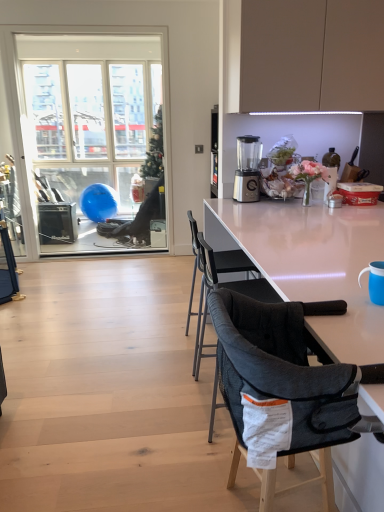
The height and width of the screenshot is (512, 384). In order to click on white glossy table at center in this screenshot , I will do `click(312, 263)`.

At what (x,y) coordinates should I click in order to perform the action: click on blue plastic cup at right. Please return your answer as a coordinate pair (x, y). Looking at the image, I should click on (375, 281).

Identify the location of sleek silver blender at center. (247, 169).

What do you see at coordinates (283, 367) in the screenshot?
I see `dark gray mesh chair at center, the 1th chair viewed from the front` at bounding box center [283, 367].

Locate an element on the screen. This screenshot has width=384, height=512. white glossy table at center is located at coordinates (312, 263).

Is dark gray fabric chair at center, placed as the second chair when sorted from front to back, thinner than clear glass window at left?

No, dark gray fabric chair at center, placed as the second chair when sorted from front to back, is not thinner than clear glass window at left.

Is dark gray fabric chair at center, the first chair from the back, not close to clear glass window at left?

Yes, dark gray fabric chair at center, the first chair from the back, is far from clear glass window at left.

Considering the positions of objects dark gray fabric chair at center, the first chair from the back, and clear glass window at left in the image provided, who is behind, dark gray fabric chair at center, the first chair from the back, or clear glass window at left?

clear glass window at left is more distant.

Considering the sizes of dark gray fabric chair at center, the first chair from the back, and clear glass window at left in the image, is dark gray fabric chair at center, the first chair from the back, bigger or smaller than clear glass window at left?

Considering their sizes, dark gray fabric chair at center, the first chair from the back, takes up more space than clear glass window at left.

From a real-world perspective, which is physically below, dark gray mesh chair at center, the 1th chair viewed from the front, or blue plastic cup at right?

In real-world perspective, dark gray mesh chair at center, the 1th chair viewed from the front, is lower.

Considering the sizes of dark gray mesh chair at center, the 1th chair viewed from the front, and blue plastic cup at right in the image, is dark gray mesh chair at center, the 1th chair viewed from the front, wider or thinner than blue plastic cup at right?

Clearly, dark gray mesh chair at center, the 1th chair viewed from the front, has more width compared to blue plastic cup at right.

Would you consider dark gray mesh chair at center, the second chair viewed from the back, to be distant from blue plastic cup at right?

That's not correct — dark gray mesh chair at center, the second chair viewed from the back, is a little close to blue plastic cup at right.

Looking at this image, could you tell me if dark gray mesh chair at center, the second chair viewed from the back, is facing blue plastic cup at right?

Yes.

Locate an element on the screen. the 2nd chair below the sleek silver blender at center (from the image's perspective) is located at coordinates (283, 367).

From a real-world perspective, which is physically above, sleek silver blender at center or dark gray mesh chair at center, the 1th chair viewed from the front?

sleek silver blender at center.

Are sleek silver blender at center and dark gray mesh chair at center, the 1th chair viewed from the front, located far from each other?

sleek silver blender at center is far away from dark gray mesh chair at center, the 1th chair viewed from the front.

How many degrees apart are the facing directions of sleek silver blender at center and dark gray mesh chair at center, the second chair viewed from the back?

There is a 78-degree angle between the facing directions of sleek silver blender at center and dark gray mesh chair at center, the second chair viewed from the back.

Could dark gray fabric chair at center, placed as the second chair when sorted from front to back, be considered to be inside clear glass window at left?

That's incorrect, dark gray fabric chair at center, placed as the second chair when sorted from front to back, is not inside clear glass window at left.

Considering the relative positions of clear glass window at left and dark gray fabric chair at center, the first chair from the back, in the image provided, is clear glass window at left behind dark gray fabric chair at center, the first chair from the back,?

Yes, clear glass window at left is further from the camera.

Considering the sizes of clear glass window at left and dark gray fabric chair at center, the first chair from the back, in the image, is clear glass window at left wider or thinner than dark gray fabric chair at center, the first chair from the back,?

A: Considering their sizes, clear glass window at left looks slimmer than dark gray fabric chair at center, the first chair from the back.

Is dark gray mesh chair at center, the second chair viewed from the back, inside or outside of clear glass window at left?

dark gray mesh chair at center, the second chair viewed from the back, is spatially situated outside clear glass window at left.

Between dark gray mesh chair at center, the second chair viewed from the back, and clear glass window at left, which one has larger size?

With larger size is clear glass window at left.

From a real-world perspective, is dark gray mesh chair at center, the 1th chair viewed from the front, located beneath clear glass window at left?

Yes, from a real-world perspective, dark gray mesh chair at center, the 1th chair viewed from the front, is beneath clear glass window at left.

Where is `window above the dark gray mesh chair at center, the second chair viewed from the back (from a real-world perspective)`? The width and height of the screenshot is (384, 512). window above the dark gray mesh chair at center, the second chair viewed from the back (from a real-world perspective) is located at coordinates (90, 133).

Is clear glass window at left wider than dark gray mesh chair at center, the second chair viewed from the back?

In fact, clear glass window at left might be narrower than dark gray mesh chair at center, the second chair viewed from the back.

Can you confirm if clear glass window at left is bigger than dark gray mesh chair at center, the 1th chair viewed from the front?

Yes.

Is clear glass window at left to the left of dark gray mesh chair at center, the second chair viewed from the back, from the viewer's perspective?

Yes, clear glass window at left is to the left of dark gray mesh chair at center, the second chair viewed from the back.

From the image's perspective, would you say clear glass window at left is shown under dark gray mesh chair at center, the second chair viewed from the back?

No, from the image's perspective, clear glass window at left is not beneath dark gray mesh chair at center, the second chair viewed from the back.

Which is more to the right, sleek silver blender at center or dark gray fabric chair at center, the first chair from the back?

Positioned to the right is sleek silver blender at center.

Is sleek silver blender at center far from dark gray fabric chair at center, placed as the second chair when sorted from front to back?

No, sleek silver blender at center is not far away from dark gray fabric chair at center, placed as the second chair when sorted from front to back.

Can you tell me how much sleek silver blender at center and dark gray fabric chair at center, the first chair from the back, differ in facing direction?

sleek silver blender at center and dark gray fabric chair at center, the first chair from the back, are facing 78 degrees away from each other.

From the image's perspective, which is below, sleek silver blender at center or dark gray fabric chair at center, placed as the second chair when sorted from front to back?

dark gray fabric chair at center, placed as the second chair when sorted from front to back, is shown below in the image.

What are the coordinates of `window that is above the dark gray fabric chair at center, placed as the second chair when sorted from front to back (from a real-world perspective)` in the screenshot? It's located at (90, 133).

I want to click on coffee cup above the dark gray mesh chair at center, the second chair viewed from the back (from the image's perspective), so click(375, 281).

When comparing their distances from dark gray fabric chair at center, placed as the second chair when sorted from front to back, does clear glass window at left or white glossy table at center seem further?

clear glass window at left.

When comparing their distances from blue plastic cup at right, does dark gray fabric chair at center, placed as the second chair when sorted from front to back, or clear glass window at left seem closer?

dark gray fabric chair at center, placed as the second chair when sorted from front to back.

Based on the photo, estimate the real-world distances between objects in this image. Which object is further from blue plastic cup at right, dark gray mesh chair at center, the second chair viewed from the back, or white glossy table at center?

The object further to blue plastic cup at right is white glossy table at center.

From the image, which object appears to be farther from white glossy table at center, dark gray fabric chair at center, placed as the second chair when sorted from front to back, or blue plastic cup at right?

blue plastic cup at right lies further to white glossy table at center than the other object.

When comparing their distances from white glossy table at center, does clear glass window at left or dark gray fabric chair at center, the first chair from the back, seem closer?

dark gray fabric chair at center, the first chair from the back, is closer to white glossy table at center.

Based on their spatial positions, is sleek silver blender at center or dark gray mesh chair at center, the second chair viewed from the back, closer to blue plastic cup at right?

dark gray mesh chair at center, the second chair viewed from the back.

When comparing their distances from white glossy table at center, does dark gray fabric chair at center, placed as the second chair when sorted from front to back, or dark gray mesh chair at center, the 1th chair viewed from the front, seem further?

Among the two, dark gray fabric chair at center, placed as the second chair when sorted from front to back, is located further to white glossy table at center.

Based on their spatial positions, is white glossy table at center or sleek silver blender at center further from dark gray mesh chair at center, the second chair viewed from the back?

sleek silver blender at center.

The width and height of the screenshot is (384, 512). I want to click on blender located between white glossy table at center and clear glass window at left in the depth direction, so click(247, 169).

I want to click on blender between blue plastic cup at right and clear glass window at left in the front-back direction, so click(247, 169).

Image resolution: width=384 pixels, height=512 pixels. Identify the location of chair located between blue plastic cup at right and clear glass window at left in the depth direction. (231, 262).

Identify the location of chair between white glossy table at center and dark gray fabric chair at center, the first chair from the back, in the front-back direction. The image size is (384, 512). [x=283, y=367].